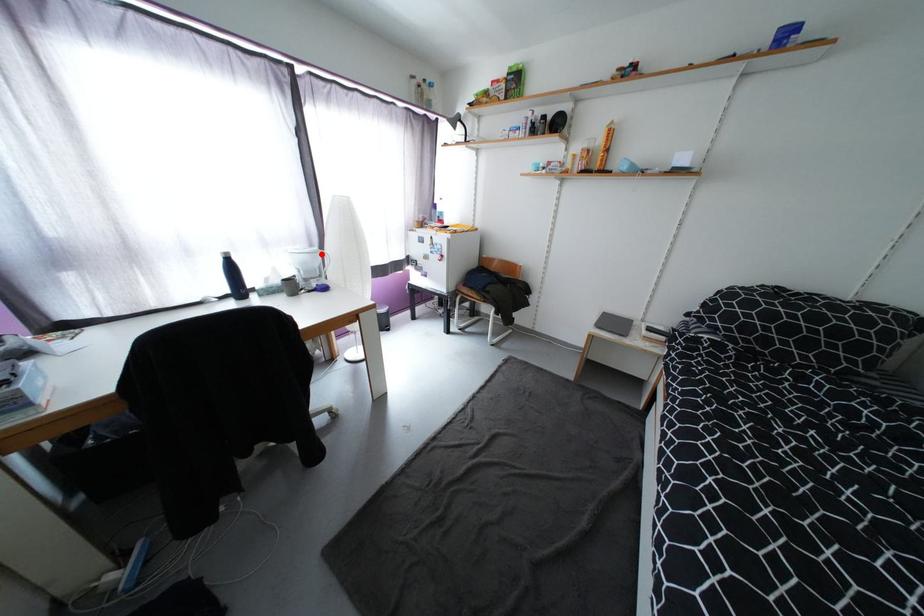
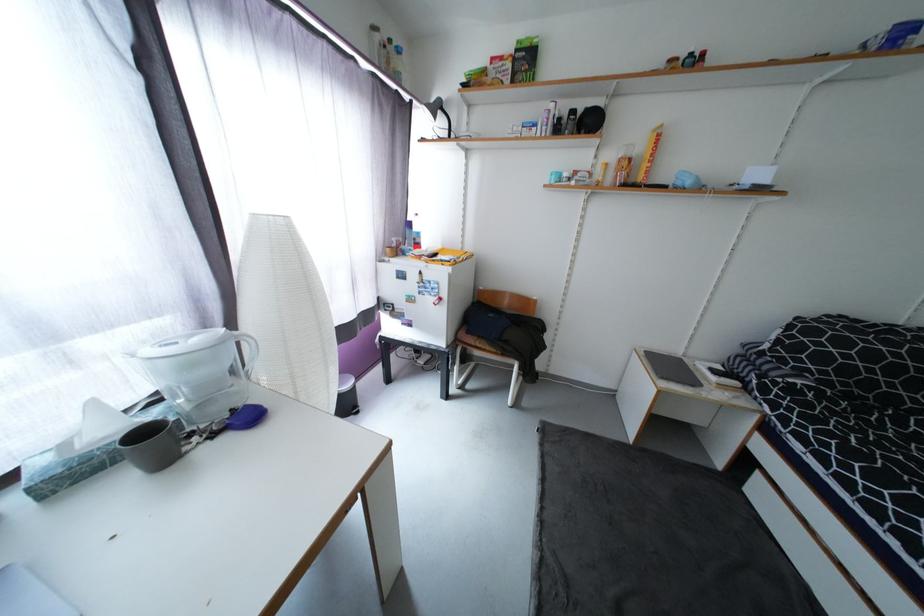
Question: I am providing you with two images of the same scene from different viewpoints. A red point is shown in image1. For the corresponding object point in image2, is it positioned nearer or farther from the camera?

Choices:
 (A) Nearer
 (B) Farther

Answer: (B)